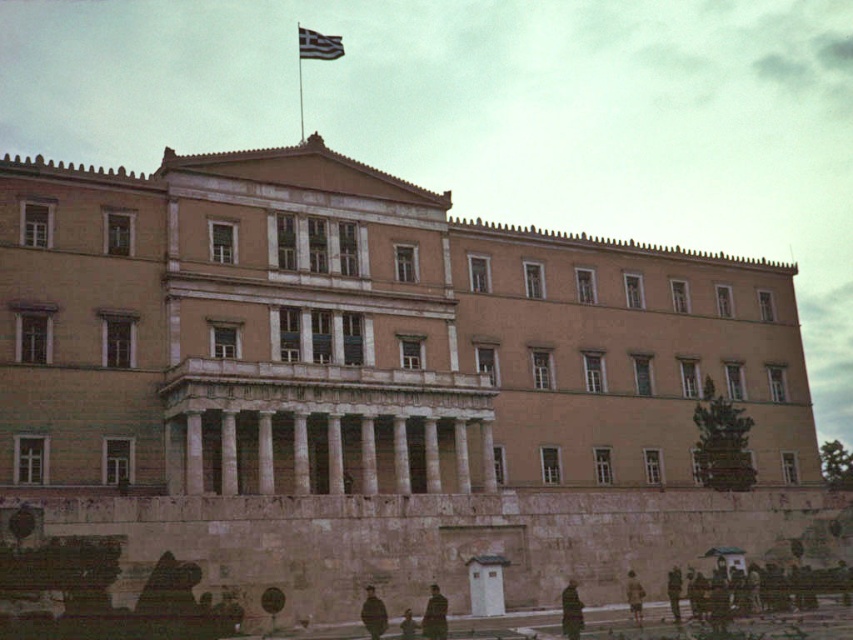
Who is positioned more to the left, white fabric flag at upper center or metallic flag pole at upper center?

metallic flag pole at upper center

Does white fabric flag at upper center have a larger size compared to metallic flag pole at upper center?

No.

Image resolution: width=853 pixels, height=640 pixels. I want to click on white fabric flag at upper center, so click(x=318, y=45).

Where is `white fabric flag at upper center`? This screenshot has width=853, height=640. white fabric flag at upper center is located at coordinates (318, 45).